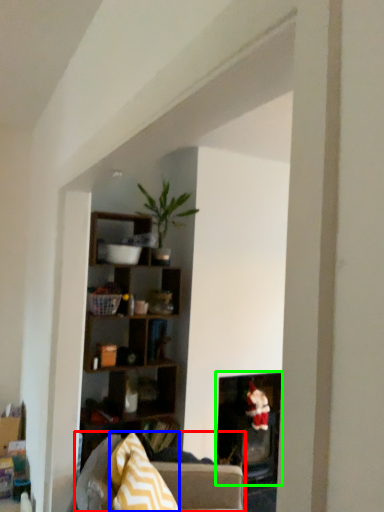
Question: Estimate the real-world distances between objects in this image. Which object is closer to studio couch (highlighted by a red box), pillow (highlighted by a blue box) or fireplace (highlighted by a green box)?

Choices:
 (A) pillow
 (B) fireplace

Answer: (A)